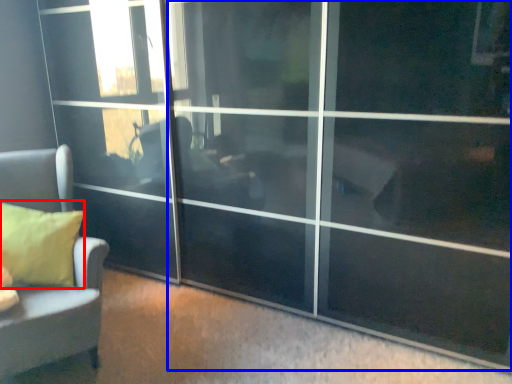
Question: Which of the following is the closest to the observer, pillow (highlighted by a red box) or screen door (highlighted by a blue box)?

Choices:
 (A) pillow
 (B) screen door

Answer: (B)